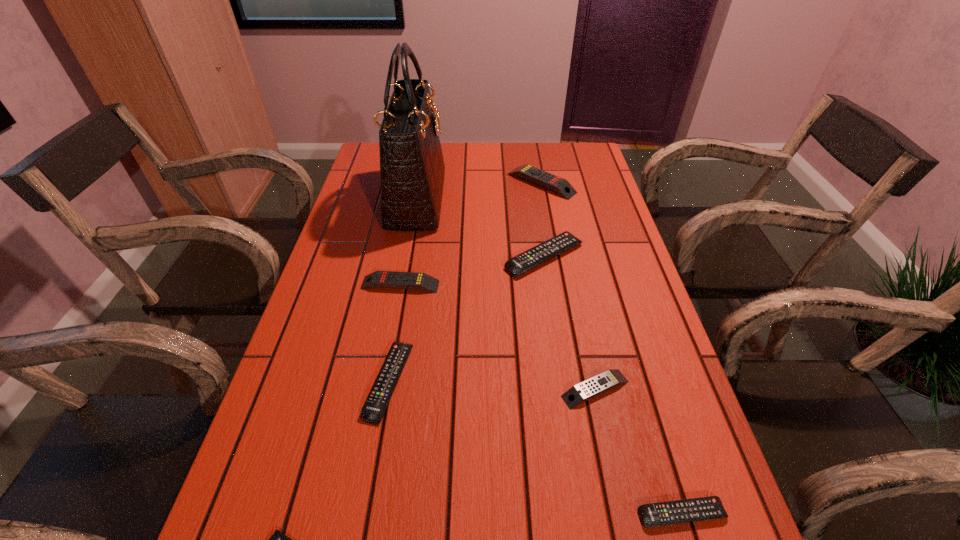
Where is `the second nearest remote control`? This screenshot has width=960, height=540. the second nearest remote control is located at coordinates (705, 508).

Locate an element on the screen. Image resolution: width=960 pixels, height=540 pixels. vacant region located 0.350m at the front of the tallest object with visible charms is located at coordinates coord(556,199).

Locate an element on the screen. This screenshot has height=540, width=960. vacant space located 0.050m on the front of the tallest remote control is located at coordinates (546, 210).

Image resolution: width=960 pixels, height=540 pixels. I want to click on free space located 0.240m on the back of the leftmost yellow remote control, so click(412, 220).

What are the coordinates of `vacant space situated 0.360m on the front of the farthest black remote control` in the screenshot? It's located at (568, 409).

I want to click on vacant region located 0.110m on the right of the second nearest black remote control, so click(x=464, y=381).

Where is `vacant space located 0.090m on the right of the smallest yellow remote control`? Image resolution: width=960 pixels, height=540 pixels. vacant space located 0.090m on the right of the smallest yellow remote control is located at coordinates (676, 389).

This screenshot has width=960, height=540. Find the location of `vacant space positioned on the left of the nearest black remote control`. vacant space positioned on the left of the nearest black remote control is located at coordinates (436, 514).

Find the location of a particular element. The width and height of the screenshot is (960, 540). handbag that is at the far edge is located at coordinates (412, 169).

Where is `remote control at the far edge`? remote control at the far edge is located at coordinates (557, 184).